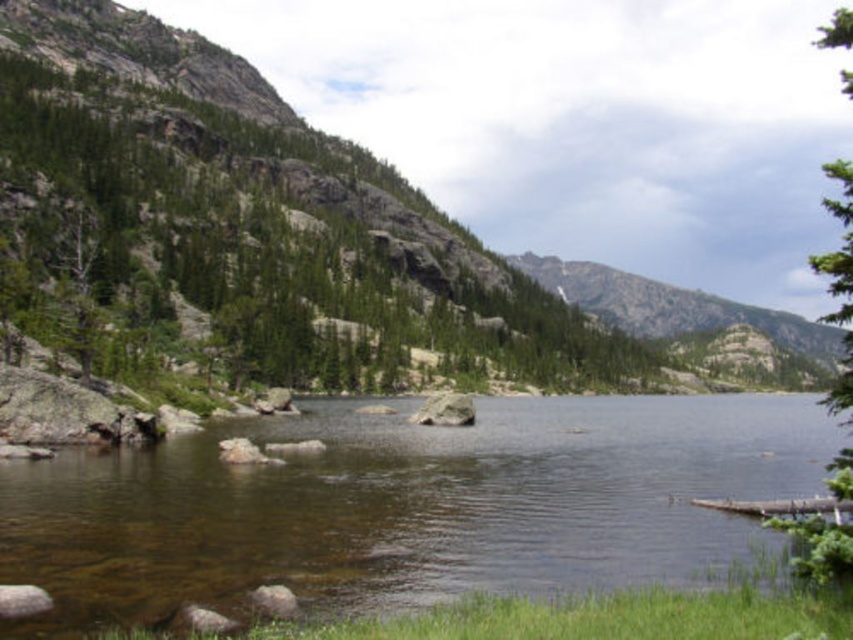
Is rocky gray mountain at center thinner than green textured tree at right?

Yes, rocky gray mountain at center is thinner than green textured tree at right.

Can you confirm if rocky gray mountain at center is positioned to the right of green textured tree at right?

Yes, rocky gray mountain at center is to the right of green textured tree at right.

Is point (689, 308) farther from camera compared to point (842, 253)?

Yes, point (689, 308) is behind point (842, 253).

Locate an element on the screen. The width and height of the screenshot is (853, 640). rocky gray mountain at center is located at coordinates (672, 307).

Who is lower down, clear water at center or rocky gray mountain at center?

clear water at center is lower down.

What do you see at coordinates (409, 506) in the screenshot? I see `clear water at center` at bounding box center [409, 506].

Locate an element on the screen. This screenshot has width=853, height=640. clear water at center is located at coordinates (409, 506).

Is clear water at center taller than smooth gray rock at center?

Yes.

Based on the photo, does clear water at center have a larger size compared to smooth gray rock at center?

Yes, clear water at center is bigger than smooth gray rock at center.

Is point (311, 528) positioned in front of point (422, 417)?

Yes, point (311, 528) is closer to viewer.

At what (x,y) coordinates should I click in order to perform the action: click on clear water at center. Please return your answer as a coordinate pair (x, y). This screenshot has height=640, width=853. Looking at the image, I should click on (409, 506).